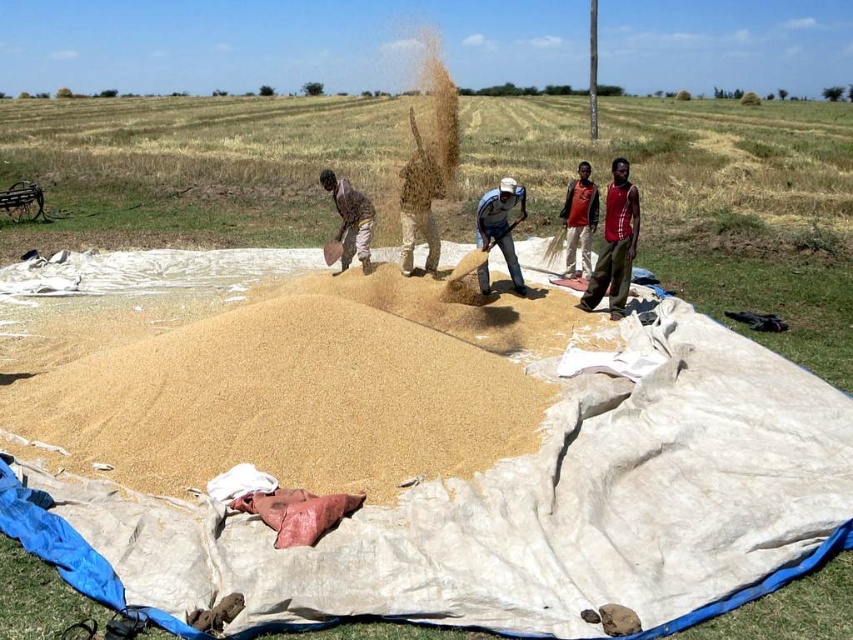
Two men are winnowing grains in the field. They are standing at points marked as point (480, 269) and another point. How far apart are they?

The two men are 10.10 meters apart.

You are a farmer who wants to collect the grains from the winnowing area. Which object should you use to collect the grains, the golden sand at center or the brown fabric bag at center?

The brown fabric bag at center should be used to collect the grains because the golden sand at center is actually the pile of grains being winnowed, and the brown fabric bag is likely the container for collecting them.